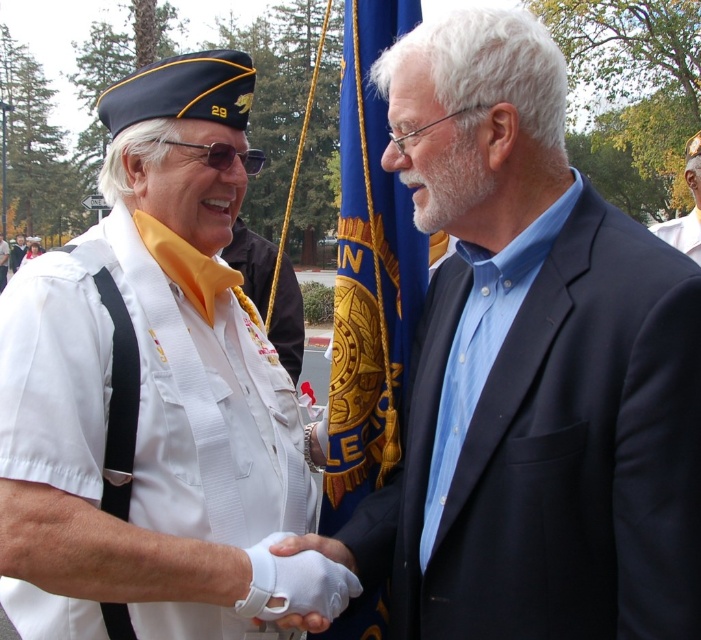
In the scene shown: You are a photographer at a formal event. You need to ensure that the white fabric uniform at left and the blue fabric flag at center are both visible in the photo. Given their sizes, which object should you position closer to the camera to maintain their visibility?

The white fabric uniform at left is larger in size than the blue fabric flag at center. To maintain visibility of both objects, you should position the smaller blue fabric flag at center closer to the camera since it requires less magnification to be seen clearly compared to the larger uniform.

You are standing in front of the two people shaking hands. You need to determine which of the two points, point (341,291) or point (697,216), is closer to you. Which one is closer?

Point (341,291) is closer to the viewer than point (697,216).